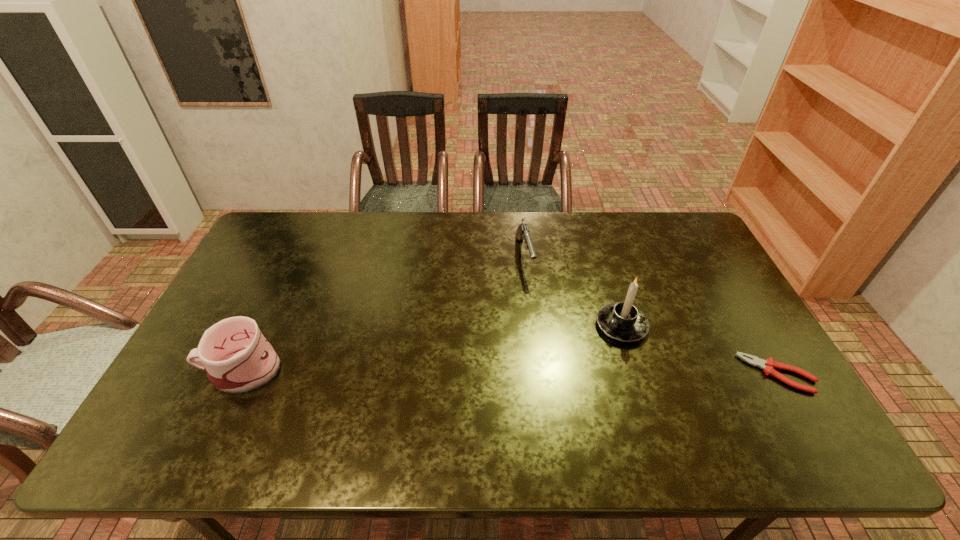
Identify the location of vacant point located between the third object from left to right and the mug. [431, 347].

Locate an element on the screen. free space between the farthest object and the third shortest object is located at coordinates click(x=382, y=313).

At what (x,y) coordinates should I click in order to perform the action: click on empty space that is in between the tallest object and the second object from left to right. Please return your answer as a coordinate pair (x, y). Looking at the image, I should click on (573, 291).

The width and height of the screenshot is (960, 540). Find the location of `unoccupied area between the gun and the rightmost object`. unoccupied area between the gun and the rightmost object is located at coordinates (651, 315).

At what (x,y) coordinates should I click in order to perform the action: click on free point between the farthest object and the shortest object. Please return your answer as a coordinate pair (x, y). The height and width of the screenshot is (540, 960). Looking at the image, I should click on (651, 315).

You are a GUI agent. You are given a task and a screenshot of the screen. Output one action in this format:
    pyautogui.click(x=<x>, y=<y>)
    Task: Click on the free spot between the gun and the third nearest object
    
    Given the screenshot: What is the action you would take?
    click(x=573, y=291)

You are a GUI agent. You are given a task and a screenshot of the screen. Output one action in this format:
    pyautogui.click(x=<x>, y=<y>)
    Task: Click on the vacant point located between the third shortest object and the second object from left to right
    
    Given the screenshot: What is the action you would take?
    pyautogui.click(x=382, y=313)

Where is `vacant point located between the second farthest object and the second tallest object`? vacant point located between the second farthest object and the second tallest object is located at coordinates (431, 347).

Image resolution: width=960 pixels, height=540 pixels. I want to click on blank region between the mug and the gun, so click(x=382, y=313).

Where is `object that stands as the second closest to the third tallest object`? The height and width of the screenshot is (540, 960). object that stands as the second closest to the third tallest object is located at coordinates (768, 365).